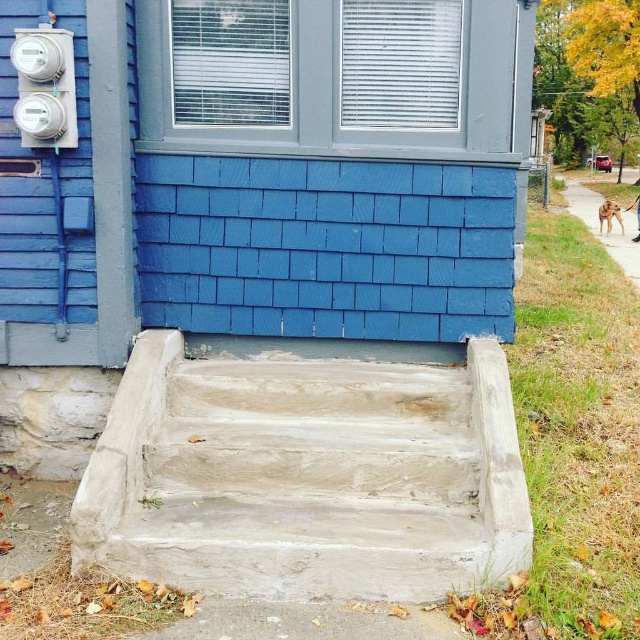
Is concrete stairs at center to the left of blue shingles at center from the viewer's perspective?

Yes, concrete stairs at center is to the left of blue shingles at center.

Who is more distant from viewer, (435,413) or (314,282)?

Positioned behind is point (314,282).

The height and width of the screenshot is (640, 640). What are the coordinates of `concrete stairs at center` in the screenshot? It's located at (307, 476).